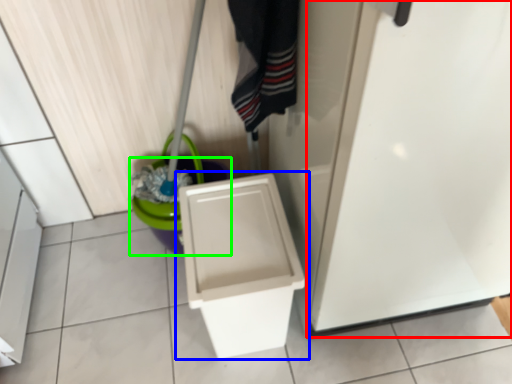
Question: Which object is the farthest from screen door (highlighted by a red box)? Choose among these: toilet (highlighted by a blue box) or potty (highlighted by a green box).

Choices:
 (A) toilet
 (B) potty

Answer: (B)